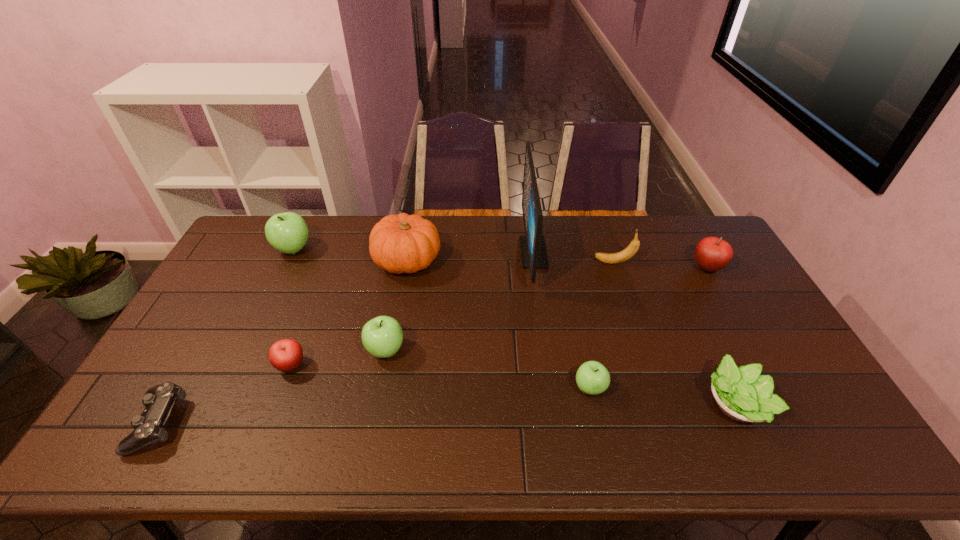
Where is `object at the far left corner`? object at the far left corner is located at coordinates (287, 232).

Locate an element on the screen. The image size is (960, 540). object at the near left corner is located at coordinates (148, 427).

The height and width of the screenshot is (540, 960). What are the coordinates of `object that is at the near right corner` in the screenshot? It's located at (742, 394).

You are a GUI agent. You are given a task and a screenshot of the screen. Output one action in this format:
    pyautogui.click(x=<x>, y=<y>)
    Task: Click on the free space at the far edge
    The height and width of the screenshot is (540, 960).
    Given the screenshot: What is the action you would take?
    pyautogui.click(x=477, y=217)

The width and height of the screenshot is (960, 540). Find the location of `vacant space at the left edge of the desktop`. vacant space at the left edge of the desktop is located at coordinates (227, 265).

At what (x,y) coordinates should I click in order to perform the action: click on free space at the right edge of the desktop. Please return your answer as a coordinate pair (x, y). The height and width of the screenshot is (540, 960). Looking at the image, I should click on (722, 307).

Locate an element on the screen. vacant point at the far left corner is located at coordinates (259, 217).

You are a GUI agent. You are given a task and a screenshot of the screen. Output one action in this format:
    pyautogui.click(x=<x>, y=<y>)
    Task: Click on the vacant space at the far right corner of the desktop
    The height and width of the screenshot is (540, 960).
    Given the screenshot: What is the action you would take?
    tap(681, 239)

Find the location of `blank region between the biggest green apple and the orange pumpkin`. blank region between the biggest green apple and the orange pumpkin is located at coordinates (350, 255).

Where is `free spot between the shortest object and the nearest green apple`? This screenshot has height=540, width=960. free spot between the shortest object and the nearest green apple is located at coordinates (373, 406).